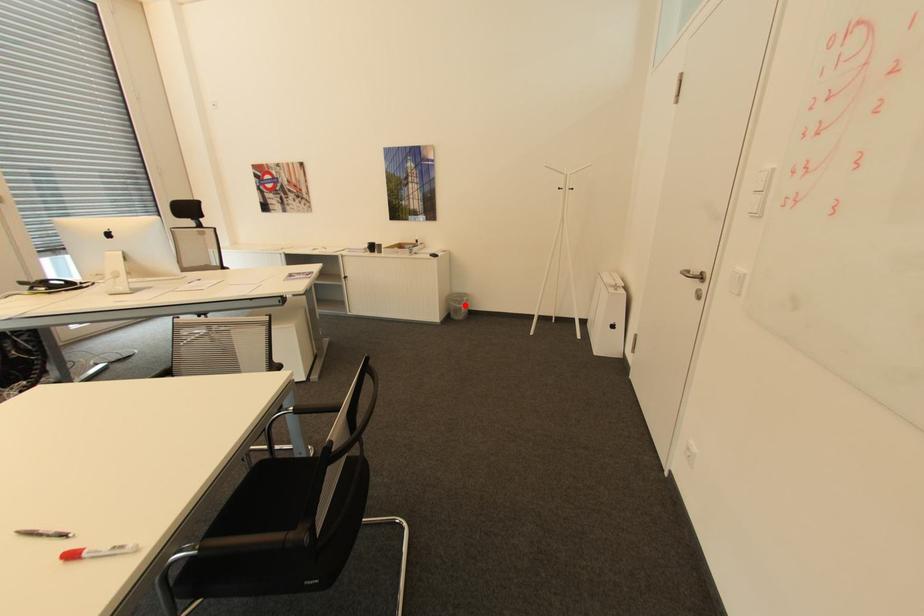
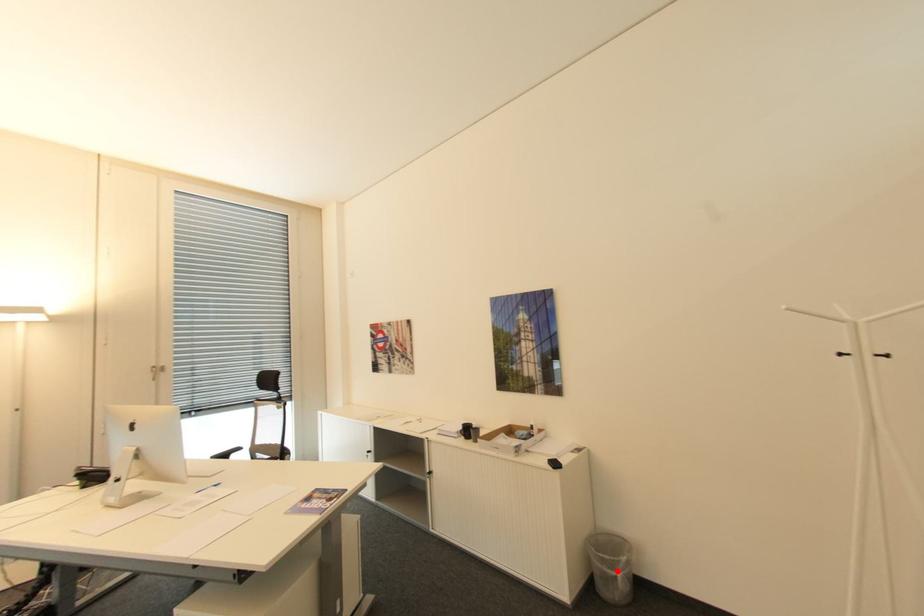
I am providing you with two images of the same scene from different viewpoints. A red point is marked on the first image and another point is marked on the second image. Does the point marked in image1 correspond to the same location as the one in image2?

Yes